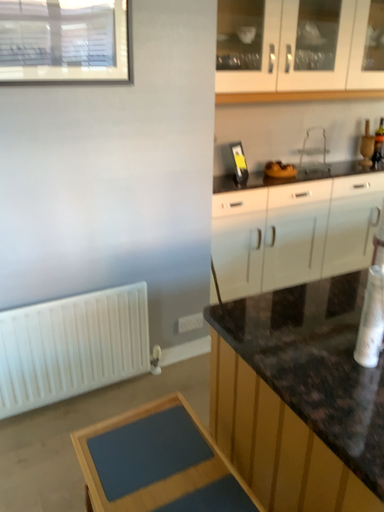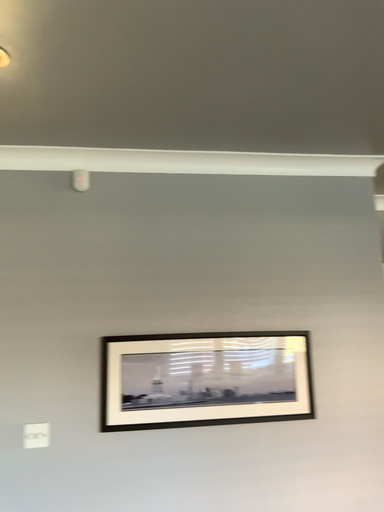
Question: How did the camera likely rotate when shooting the video?

Choices:
 (A) rotated right
 (B) rotated left

Answer: (B)